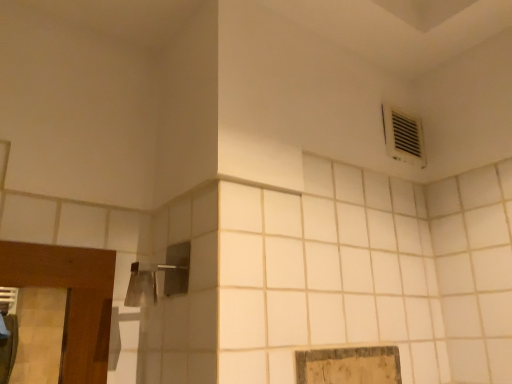
Describe the element at coordinates (156, 277) in the screenshot. The height and width of the screenshot is (384, 512). I see `brushed metal shower head at upper left` at that location.

Where is `brushed metal shower head at upper left`? The image size is (512, 384). brushed metal shower head at upper left is located at coordinates (156, 277).

Locate an element on the screen. The width and height of the screenshot is (512, 384). white plastic air conditioning at upper right is located at coordinates (x=403, y=136).

What do you see at coordinates (403, 136) in the screenshot? I see `white plastic air conditioning at upper right` at bounding box center [403, 136].

Measure the distance between white plastic air conditioning at upper right and camera.

The distance of white plastic air conditioning at upper right from camera is 3.75 feet.

Locate an element on the screen. brushed metal shower head at upper left is located at coordinates (156, 277).

Based on their positions, is brushed metal shower head at upper left located to the left or right of white plastic air conditioning at upper right?

brushed metal shower head at upper left is to the left of white plastic air conditioning at upper right.

Is the depth of brushed metal shower head at upper left less than that of white plastic air conditioning at upper right?

Yes, brushed metal shower head at upper left is closer to the viewer.

Considering the points (156, 281) and (419, 165), which point is behind, point (156, 281) or point (419, 165)?

The point (419, 165) is behind.

From the image's perspective, is brushed metal shower head at upper left on white plastic air conditioning at upper right?

No, from the image's perspective, brushed metal shower head at upper left is not over white plastic air conditioning at upper right.

From a real-world perspective, is brushed metal shower head at upper left under white plastic air conditioning at upper right?

Indeed, from a real-world perspective, brushed metal shower head at upper left is positioned beneath white plastic air conditioning at upper right.

Considering the sizes of objects brushed metal shower head at upper left and white plastic air conditioning at upper right in the image provided, who is wider, brushed metal shower head at upper left or white plastic air conditioning at upper right?

With larger width is brushed metal shower head at upper left.

From their relative heights in the image, would you say brushed metal shower head at upper left is taller or shorter than white plastic air conditioning at upper right?

Considering their sizes, brushed metal shower head at upper left has less height than white plastic air conditioning at upper right.

Considering the sizes of objects brushed metal shower head at upper left and white plastic air conditioning at upper right in the image provided, who is smaller, brushed metal shower head at upper left or white plastic air conditioning at upper right?

With smaller size is white plastic air conditioning at upper right.

Can white plastic air conditioning at upper right be found inside brushed metal shower head at upper left?

Actually, white plastic air conditioning at upper right is outside brushed metal shower head at upper left.

Based on the photo, is brushed metal shower head at upper left next to white plastic air conditioning at upper right and touching it?

No, brushed metal shower head at upper left is not next to white plastic air conditioning at upper right.

Is brushed metal shower head at upper left facing towards white plastic air conditioning at upper right?

No.

How different are the orientations of brushed metal shower head at upper left and white plastic air conditioning at upper right in degrees?

The angular difference between brushed metal shower head at upper left and white plastic air conditioning at upper right is 89.7 degrees.

Find the location of a particular element. air conditioning behind the brushed metal shower head at upper left is located at coordinates (403, 136).

Considering the positions of objects white plastic air conditioning at upper right and brushed metal shower head at upper left in the image provided, who is more to the left, white plastic air conditioning at upper right or brushed metal shower head at upper left?

brushed metal shower head at upper left.

Is the depth of white plastic air conditioning at upper right less than that of brushed metal shower head at upper left?

That is False.

Is point (420, 151) closer to camera compared to point (141, 297)?

No, (420, 151) is behind (141, 297).

From the image's perspective, which is above, white plastic air conditioning at upper right or brushed metal shower head at upper left?

white plastic air conditioning at upper right is shown above in the image.

From a real-world perspective, between white plastic air conditioning at upper right and brushed metal shower head at upper left, who is vertically higher?

From a 3D spatial view, white plastic air conditioning at upper right is above.

Is white plastic air conditioning at upper right wider or thinner than brushed metal shower head at upper left?

white plastic air conditioning at upper right is thinner than brushed metal shower head at upper left.

Is white plastic air conditioning at upper right taller or shorter than brushed metal shower head at upper left?

In the image, white plastic air conditioning at upper right appears to be taller than brushed metal shower head at upper left.

Considering the sizes of objects white plastic air conditioning at upper right and brushed metal shower head at upper left in the image provided, who is smaller, white plastic air conditioning at upper right or brushed metal shower head at upper left?

white plastic air conditioning at upper right.

Would you say white plastic air conditioning at upper right is outside brushed metal shower head at upper left?

white plastic air conditioning at upper right lies outside brushed metal shower head at upper left's area.

Are white plastic air conditioning at upper right and brushed metal shower head at upper left located far from each other?

No.

Is white plastic air conditioning at upper right turned away from brushed metal shower head at upper left?

No.

Can you tell me how much white plastic air conditioning at upper right and brushed metal shower head at upper left differ in facing direction?

The angular difference between white plastic air conditioning at upper right and brushed metal shower head at upper left is 89.7 degrees.

Where is `shower on the left of white plastic air conditioning at upper right`? The height and width of the screenshot is (384, 512). shower on the left of white plastic air conditioning at upper right is located at coordinates (156, 277).

The width and height of the screenshot is (512, 384). In order to click on air conditioning above the brushed metal shower head at upper left (from the image's perspective) in this screenshot , I will do `click(403, 136)`.

At what (x,y) coordinates should I click in order to perform the action: click on air conditioning lying behind the brushed metal shower head at upper left. Please return your answer as a coordinate pair (x, y). This screenshot has width=512, height=384. Looking at the image, I should click on (403, 136).